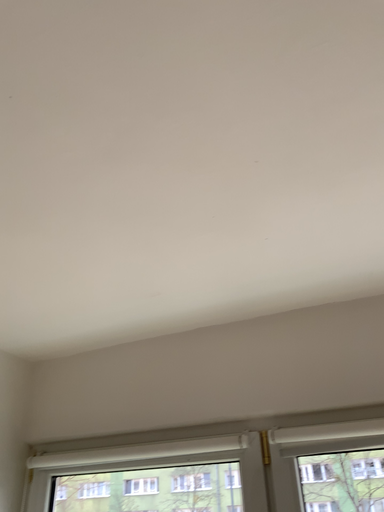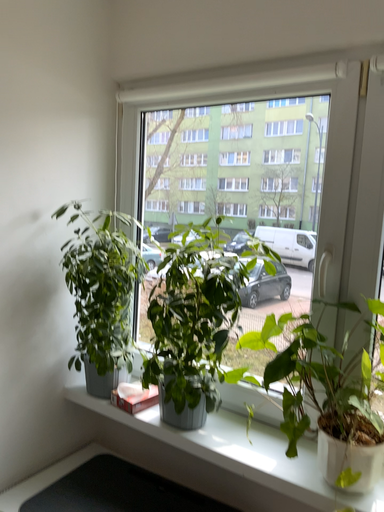
Question: How did the camera likely rotate when shooting the video?

Choices:
 (A) rotated left
 (B) rotated right

Answer: (A)